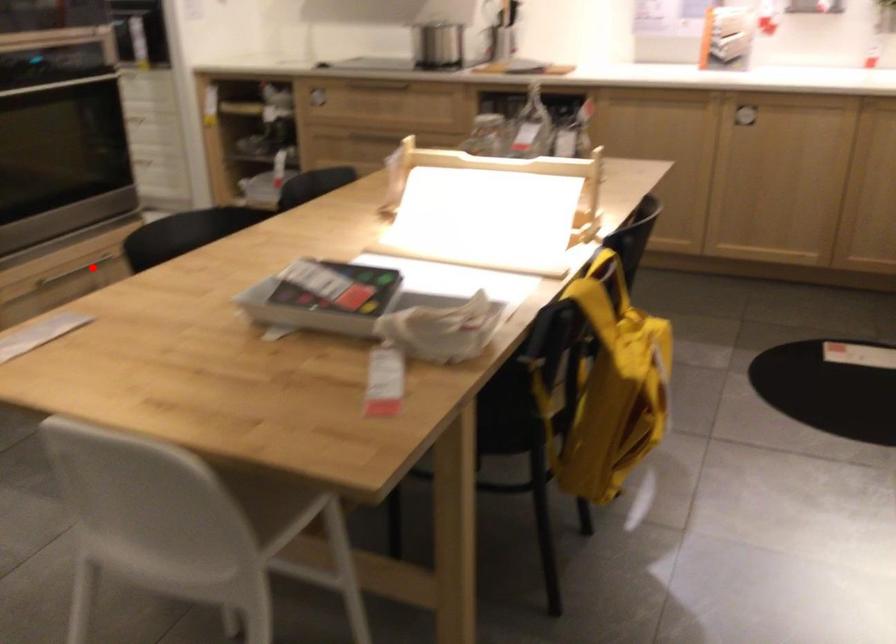
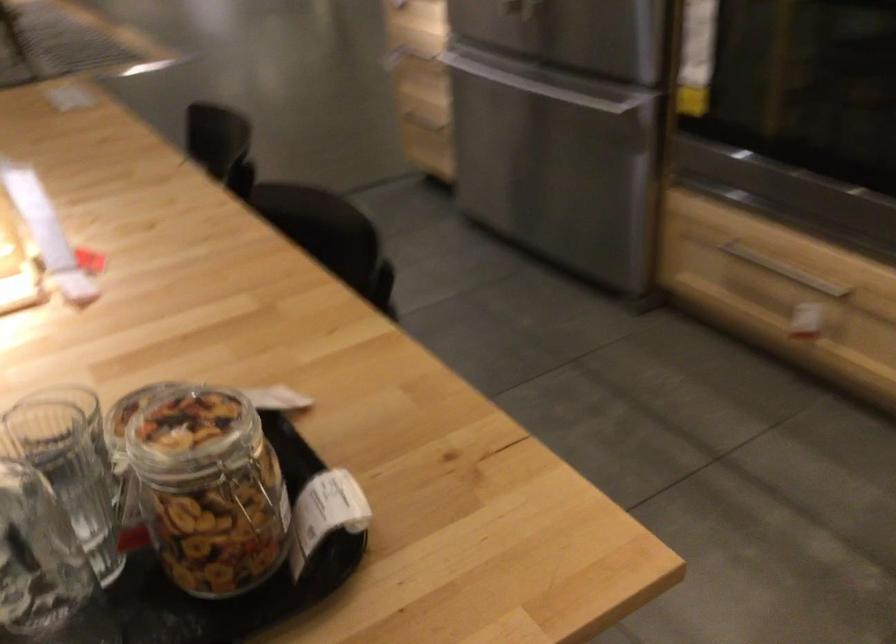
Question: I am providing you with two images of the same scene from different viewpoints. Image1 has a red point marked. In image2, the corresponding 3D location appears at what relative position? Reply with the corresponding letter.

Choices:
 (A) Closer
 (B) Farther

Answer: (A)